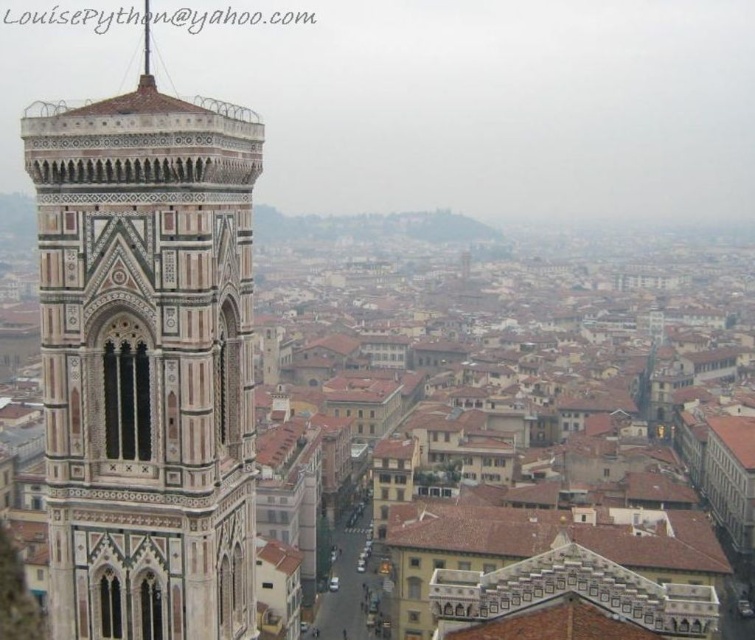
You are an architect analyzing the spatial arrangement of Florence. You observe the marble mosaic bell tower at left and the polished silver spire at upper center. Which structure is closer to the observer in this view?

The marble mosaic bell tower at left is closer to the observer because it is positioned in front of the polished silver spire at upper center.

You are an architect analyzing the Florence skyline. You observe the marble mosaic bell tower at left and the polished silver spire at upper center. Which structure has a greater width?

The marble mosaic bell tower at left is thinner than the polished silver spire at upper center, so the polished silver spire at upper center has a greater width.